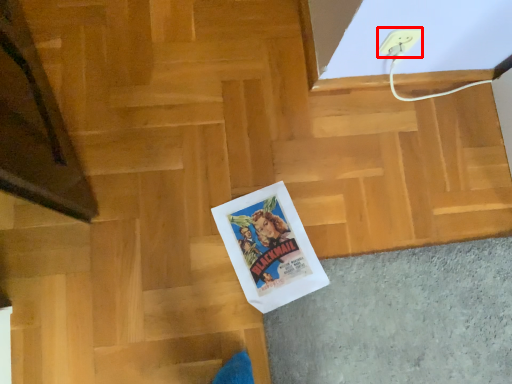
Question: From the image, what is the correct spatial relationship of electric outlet (annotated by the red box) in relation to stairwell?

Choices:
 (A) left
 (B) right

Answer: (B)